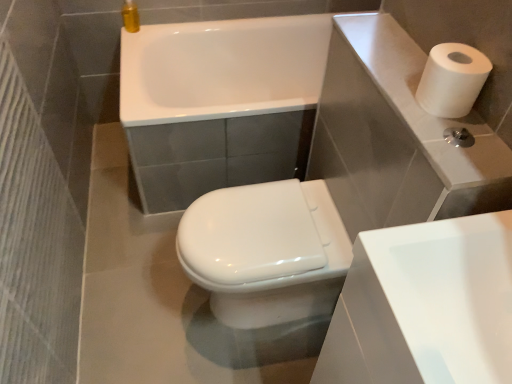
Find the location of a particular element. vacant area on top of white glossy bidet at center (from a real-world perspective) is located at coordinates (248, 222).